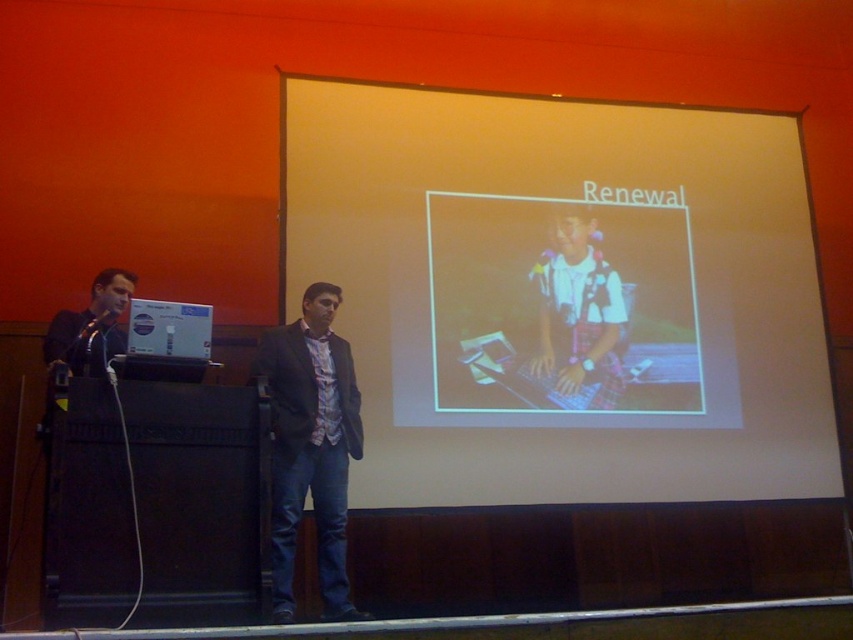
Between matte black suit at center and metallic shiny microphone at left, which one is positioned higher?

Positioned higher is metallic shiny microphone at left.

Does matte black suit at center have a smaller size compared to metallic shiny microphone at left?

Incorrect, matte black suit at center is not smaller in size than metallic shiny microphone at left.

Where is `matte black suit at center`? matte black suit at center is located at coordinates (311, 445).

Who is shorter, plaid shirt at center or matte black suit at left?

matte black suit at left

Who is more distant from viewer, (625, 339) or (107, 314)?

The point (625, 339) is behind.

Where is `plaid shirt at center`? The height and width of the screenshot is (640, 853). plaid shirt at center is located at coordinates (582, 314).

What do you see at coordinates (582, 314) in the screenshot?
I see `plaid shirt at center` at bounding box center [582, 314].

Does point (624, 316) lie behind point (114, 321)?

Yes, it is.

Which is behind, point (564, 364) or point (91, 316)?

The point (564, 364) is more distant.

Image resolution: width=853 pixels, height=640 pixels. What are the coordinates of `plaid shirt at center` in the screenshot? It's located at (582, 314).